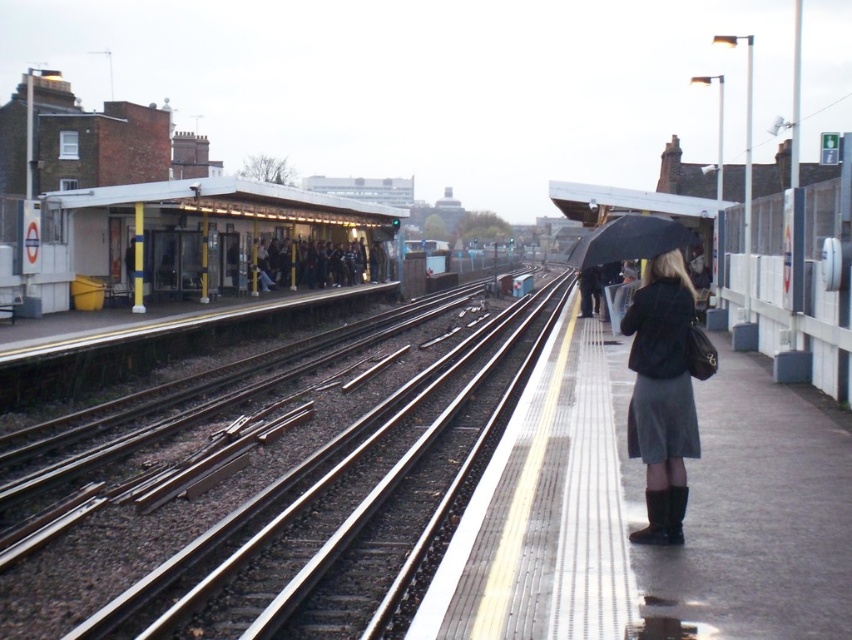
Question: Which object is the closest to the metal tracks at center?

Choices:
 (A) white plastic shelter at upper left
 (B) dark gray fabric coat at upper center
 (C) dark gray concrete platform at right
 (D) matte black jacket at center

Answer: (C)

Question: Is dark gray concrete platform at right closer to the viewer compared to dark gray fabric coat at upper center?

Choices:
 (A) no
 (B) yes

Answer: (B)

Question: Is white plastic shelter at upper left positioned behind matte black jacket at center?

Choices:
 (A) yes
 (B) no

Answer: (A)

Question: Can you confirm if metal tracks at center is positioned to the left of black matte umbrella at center-right?

Choices:
 (A) no
 (B) yes

Answer: (B)

Question: Among these points, which one is farthest from the camera?

Choices:
 (A) (646, 502)
 (B) (285, 248)
 (C) (308, 445)

Answer: (B)

Question: Which object is positioned closest to the metal tracks at center?

Choices:
 (A) black matte umbrella at center-right
 (B) dark gray concrete platform at right

Answer: (B)